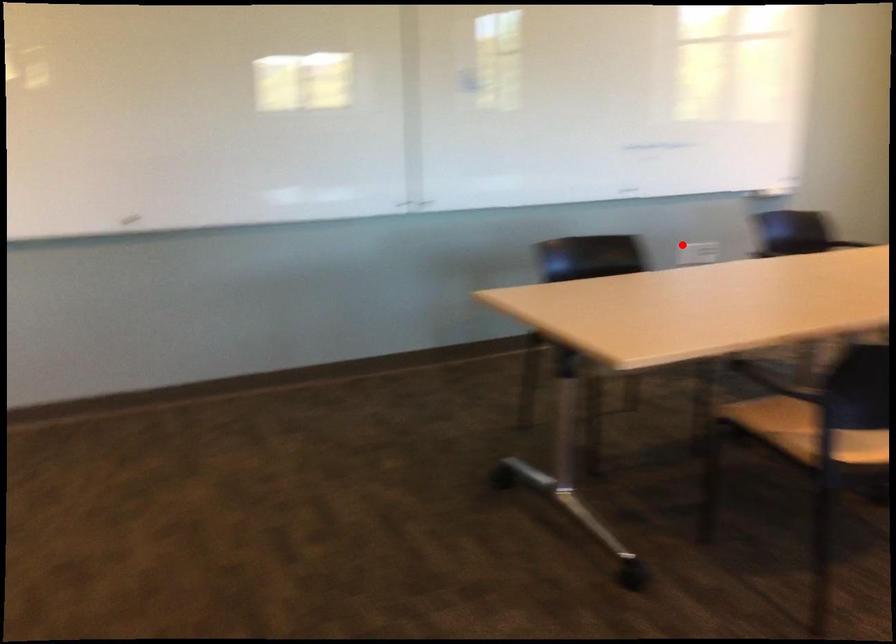
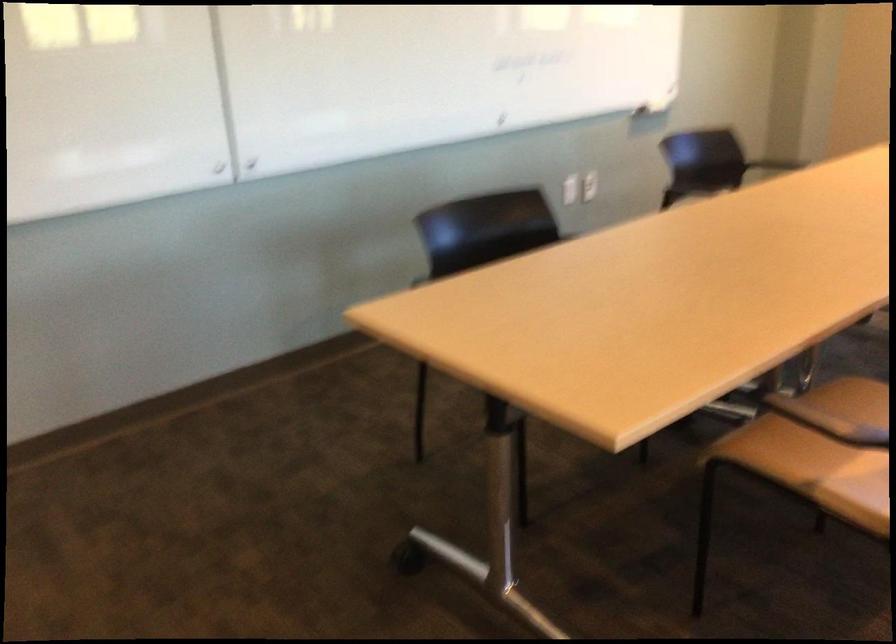
In the second image, find the point that corresponds to the highlighted location in the first image.

(570, 189)